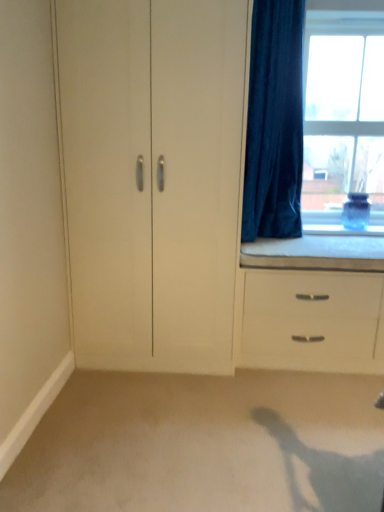
At what (x,y) coordinates should I click in order to perform the action: click on free spot to the right of white matte cabinet at center. Please return your answer as a coordinate pair (x, y). Image resolution: width=384 pixels, height=512 pixels. Looking at the image, I should click on (263, 391).